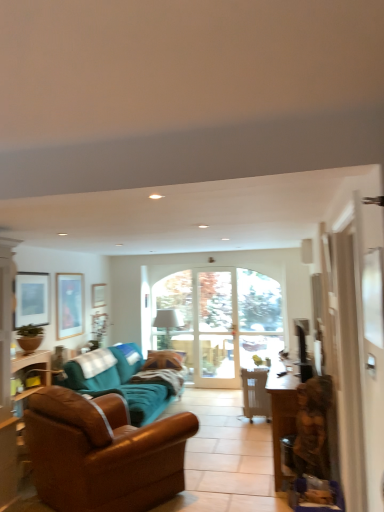
How much space does matte wooden picture frame at upper left, the third picture frame viewed from the left, occupy horizontally?

matte wooden picture frame at upper left, the third picture frame viewed from the left, is 1.89 inches in width.

This screenshot has height=512, width=384. What do you see at coordinates (103, 453) in the screenshot?
I see `brown leather couch at lower left, which appears as the first studio couch when viewed from the front` at bounding box center [103, 453].

This screenshot has height=512, width=384. Identify the location of teal fabric couch at center, which is counted as the first studio couch, starting from the back. (120, 382).

Measure the distance between teal fabric couch at center, which is counted as the first studio couch, starting from the back, and camera.

The depth of teal fabric couch at center, which is counted as the first studio couch, starting from the back, is 13.71 feet.

Locate an element on the screen. matte black picture frame at upper left, the 1th picture frame in the left-to-right sequence is located at coordinates (32, 298).

In order to face matte black picture frame at upper left, the 3th picture frame positioned from the right, should I rotate leftwards or rightwards?

To align with it, rotate left about 20.283°.

Where is `matte wooden picture frame at upper left, which is counted as the 1th picture frame, starting from the back`? Image resolution: width=384 pixels, height=512 pixels. matte wooden picture frame at upper left, which is counted as the 1th picture frame, starting from the back is located at coordinates (98, 295).

Does brown leather couch at lower left, which appears as the 2th studio couch when viewed from the back, have a lesser width compared to matte wooden picture frame at upper left, the third picture frame viewed from the left?

In fact, brown leather couch at lower left, which appears as the 2th studio couch when viewed from the back, might be wider than matte wooden picture frame at upper left, the third picture frame viewed from the left.

Measure the distance from brown leather couch at lower left, which appears as the first studio couch when viewed from the front, to matte wooden picture frame at upper left, which is counted as the 1th picture frame, starting from the back.

They are 3.45 meters apart.

Could matte wooden picture frame at upper left, which is counted as the 1th picture frame, starting from the back, be considered to be inside brown leather couch at lower left, which appears as the 2th studio couch when viewed from the back?

No, matte wooden picture frame at upper left, which is counted as the 1th picture frame, starting from the back, is located outside of brown leather couch at lower left, which appears as the 2th studio couch when viewed from the back.

Would you say brown leather couch at lower left, which appears as the 2th studio couch when viewed from the back, is to the left or to the right of matte wooden picture frame at upper left, the 3th picture frame from the front, in the picture?

brown leather couch at lower left, which appears as the 2th studio couch when viewed from the back, is positioned on matte wooden picture frame at upper left, the 3th picture frame from the front,'s right side.

Is the depth of matte black picture frame at upper left, the 3th picture frame positioned from the right, less than that of clear glass door at center?

Yes, matte black picture frame at upper left, the 3th picture frame positioned from the right, is closer to the viewer.

Looking at this image, are matte black picture frame at upper left, the 3th picture frame positioned from the right, and clear glass door at center far apart?

Yes, matte black picture frame at upper left, the 3th picture frame positioned from the right, is far from clear glass door at center.

Is matte black picture frame at upper left, which is the first picture frame from front to back, not within clear glass door at center?

Yes, matte black picture frame at upper left, which is the first picture frame from front to back, is located beyond the bounds of clear glass door at center.

Is matte black picture frame at upper left, the 3th picture frame positioned from the right, oriented towards clear glass door at center?

No, matte black picture frame at upper left, the 3th picture frame positioned from the right, does not turn towards clear glass door at center.

Consider the image. Is white fabric lampshade at center taller or shorter than satin black television at right?

Clearly, white fabric lampshade at center is taller compared to satin black television at right.

From the picture: From a real-world perspective, is white fabric lampshade at center below satin black television at right?

Yes, from a real-world perspective, white fabric lampshade at center is under satin black television at right.

Locate an element on the screen. lamp behind the satin black television at right is located at coordinates (168, 323).

Can you confirm if white fabric lampshade at center is positioned to the left of satin black television at right?

Indeed, white fabric lampshade at center is positioned on the left side of satin black television at right.

Does point (310, 470) come farther from viewer compared to point (256, 373)?

No, it is in front of (256, 373).

Which of these two, wooden statue at right or metallic silver chair at center, is smaller?

metallic silver chair at center.

Which is more to the right, wooden statue at right or metallic silver chair at center?

wooden statue at right is more to the right.

From the image's perspective, is brown leather couch at lower left, which appears as the first studio couch when viewed from the front, above satin black television at right?

No, from the image's perspective, brown leather couch at lower left, which appears as the first studio couch when viewed from the front, is not over satin black television at right.

You are a GUI agent. You are given a task and a screenshot of the screen. Output one action in this format:
    pyautogui.click(x=<x>, y=<y>)
    Task: Click on the television located above the brown leather couch at lower left, which appears as the 2th studio couch when viewed from the back (from a real-world perspective)
    This screenshot has width=384, height=512.
    Given the screenshot: What is the action you would take?
    pyautogui.click(x=301, y=338)

From a real-world perspective, who is located lower, brown leather couch at lower left, which appears as the 2th studio couch when viewed from the back, or satin black television at right?

brown leather couch at lower left, which appears as the 2th studio couch when viewed from the back, is physically lower.

Does brown leather couch at lower left, which appears as the 2th studio couch when viewed from the back, turn towards satin black television at right?

Yes.

Considering the relative sizes of matte wooden picture frame at upper left, which is counted as the 1th picture frame, starting from the back, and teal fabric couch at center, which is the second studio couch in front-to-back order, in the image provided, is matte wooden picture frame at upper left, which is counted as the 1th picture frame, starting from the back, thinner than teal fabric couch at center, which is the second studio couch in front-to-back order,?

Yes, matte wooden picture frame at upper left, which is counted as the 1th picture frame, starting from the back, is thinner than teal fabric couch at center, which is the second studio couch in front-to-back order.

Does matte wooden picture frame at upper left, the third picture frame viewed from the left, lie in front of teal fabric couch at center, which is counted as the first studio couch, starting from the back?

No, matte wooden picture frame at upper left, the third picture frame viewed from the left, is further to the viewer.

Which of these two, matte wooden picture frame at upper left, arranged as the 1th picture frame when viewed from the right, or teal fabric couch at center, which is the second studio couch in front-to-back order, is bigger?

With larger size is teal fabric couch at center, which is the second studio couch in front-to-back order.

In terms of height, does matte wooden picture frame at upper left, the third picture frame viewed from the left, look taller or shorter compared to teal fabric couch at center, which is the second studio couch in front-to-back order?

In the image, matte wooden picture frame at upper left, the third picture frame viewed from the left, appears to be shorter than teal fabric couch at center, which is the second studio couch in front-to-back order.

Does satin black television at right have a smaller size compared to teal fabric couch at center, which is the second studio couch in front-to-back order?

Yes, satin black television at right is smaller than teal fabric couch at center, which is the second studio couch in front-to-back order.

How far apart are satin black television at right and teal fabric couch at center, which is the second studio couch in front-to-back order?

satin black television at right is 1.97 meters from teal fabric couch at center, which is the second studio couch in front-to-back order.

How different are the orientations of satin black television at right and teal fabric couch at center, which is counted as the first studio couch, starting from the back, in degrees?

The angle between the facing direction of satin black television at right and the facing direction of teal fabric couch at center, which is counted as the first studio couch, starting from the back, is 178 degrees.

From a real-world perspective, is satin black television at right below teal fabric couch at center, which is counted as the first studio couch, starting from the back?

Actually, satin black television at right is physically above teal fabric couch at center, which is counted as the first studio couch, starting from the back, in the real world.

From the brown leather couch at lower left, which appears as the first studio couch when viewed from the front, count the 1st picture frame to the left and point to it. Please provide its 2D coordinates.

[(98, 295)]

What are the coordinates of `screen door below the matte black picture frame at upper left, the 3th picture frame positioned from the right (from the image's perspective)` in the screenshot? It's located at (215, 329).

Based on the photo, looking at the image, which one is located further to matte glass picture frame at left, the 2th picture frame when ordered from front to back, brown leather couch at lower left, which appears as the 2th studio couch when viewed from the back, or white fabric lampshade at center?

brown leather couch at lower left, which appears as the 2th studio couch when viewed from the back, lies further to matte glass picture frame at left, the 2th picture frame when ordered from front to back, than the other object.

Estimate the real-world distances between objects in this image. Which object is further from brown leather couch at lower left, which appears as the first studio couch when viewed from the front, clear glass door at center or wooden statue at right?

clear glass door at center lies further to brown leather couch at lower left, which appears as the first studio couch when viewed from the front, than the other object.

Looking at this image, which object lies further to the anchor point brown leather couch at lower left, which appears as the 2th studio couch when viewed from the back, white fabric lampshade at center or metallic silver chair at center?

Among the two, white fabric lampshade at center is located further to brown leather couch at lower left, which appears as the 2th studio couch when viewed from the back.

Looking at this image, based on their spatial positions, is green matte plant at upper left or matte black picture frame at upper left, the 3th picture frame positioned from the right, further from wooden statue at right?

matte black picture frame at upper left, the 3th picture frame positioned from the right, is further to wooden statue at right.

Based on their spatial positions, is matte wooden picture frame at upper left, the third picture frame viewed from the left, or brown leather couch at lower left, which appears as the 2th studio couch when viewed from the back, further from green matte plant at upper left?

matte wooden picture frame at upper left, the third picture frame viewed from the left.

From the picture: When comparing their distances from matte wooden picture frame at upper left, which is counted as the 1th picture frame, starting from the back, does matte black picture frame at upper left, which is the first picture frame from front to back, or wooden statue at right seem closer?

matte black picture frame at upper left, which is the first picture frame from front to back, is positioned closer to the anchor matte wooden picture frame at upper left, which is counted as the 1th picture frame, starting from the back.

When comparing their distances from wooden statue at right, does satin black television at right or white fabric lampshade at center seem further?

white fabric lampshade at center.

Estimate the real-world distances between objects in this image. Which object is closer to matte black picture frame at upper left, which is the first picture frame from front to back, clear glass door at center or matte wooden picture frame at upper left, arranged as the 1th picture frame when viewed from the right?

The object closer to matte black picture frame at upper left, which is the first picture frame from front to back, is matte wooden picture frame at upper left, arranged as the 1th picture frame when viewed from the right.

The height and width of the screenshot is (512, 384). I want to click on screen door situated between matte wooden picture frame at upper left, the third picture frame viewed from the left, and metallic silver chair at center from left to right, so click(215, 329).

Find the location of a particular element. chair between matte black picture frame at upper left, which is the first picture frame from front to back, and satin black television at right from left to right is located at coordinates (255, 394).

Locate an element on the screen. This screenshot has width=384, height=512. chair positioned between brown leather couch at lower left, which appears as the 2th studio couch when viewed from the back, and clear glass door at center from near to far is located at coordinates (255, 394).

Find the location of a particular element. The width and height of the screenshot is (384, 512). studio couch between brown leather couch at lower left, which appears as the first studio couch when viewed from the front, and matte wooden picture frame at upper left, which is counted as the 1th picture frame, starting from the back, in the front-back direction is located at coordinates (120, 382).